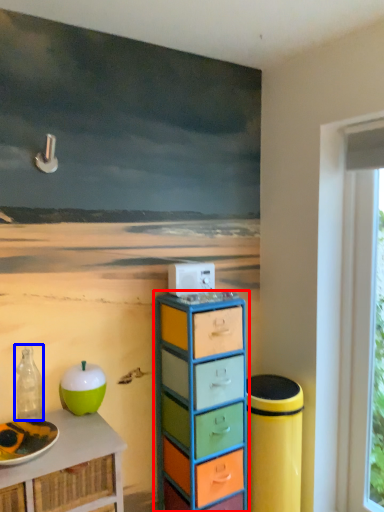
Question: Among these objects, which one is nearest to the camera, chest of drawers (highlighted by a red box) or bottle (highlighted by a blue box)?

Choices:
 (A) chest of drawers
 (B) bottle

Answer: (B)